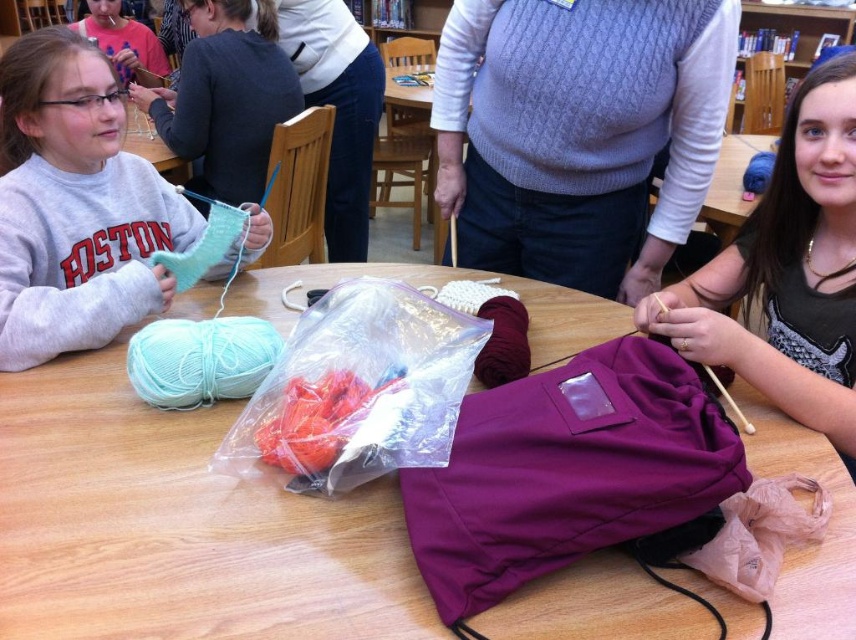
You are a photographer trying to capture a closeup of the wooden table at center and the gray cotton sweatshirt at left. Since you want to focus on both objects equally, which one should you adjust the camera focus for first?

The wooden table at center is shorter than gray cotton sweatshirt at left, so you should focus on the wooden table at center first to ensure both are in focus.

You are a visitor in the library and want to place a small book on the wooden table at center. However, you notice the gray cotton sweatshirt at left is already on the table. Can you still place your book there without moving the sweatshirt?

The wooden table at center is below gray cotton sweatshirt at left, meaning the sweatshirt is placed on top of the table. Therefore, there is space left on the table to place your small book without moving the gray cotton sweatshirt at left.

You are a fashion designer observing the knitting scene. You notice the gray cotton sweatshirt at left and the matte pink sweater at upper left. Which one would you recommend for a client who prefers a more oversized style?

The gray cotton sweatshirt at left is larger in size than the matte pink sweater at upper left, so it would be the better recommendation for an oversized style.